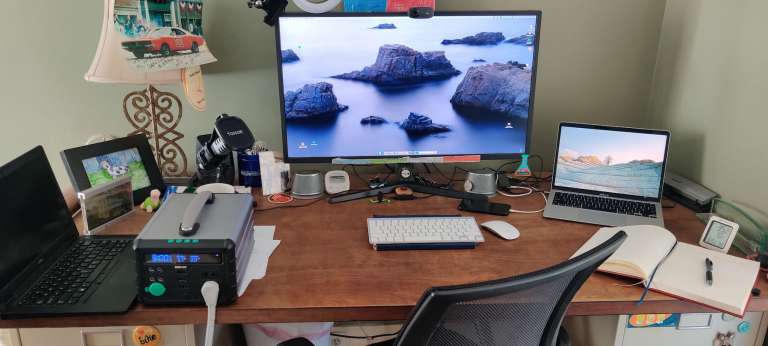
The height and width of the screenshot is (346, 768). Find the location of `desktop lamp`. desktop lamp is located at coordinates (114, 68).